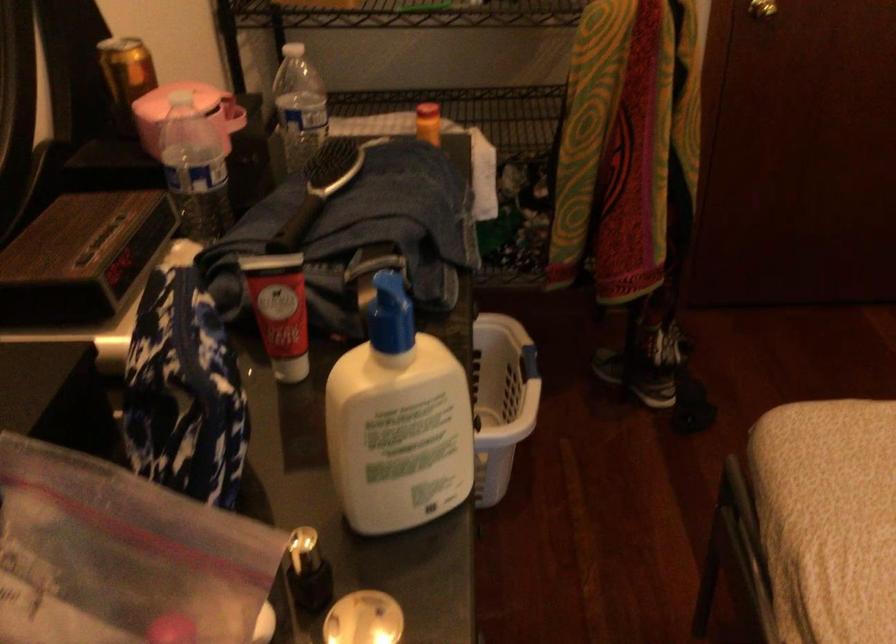
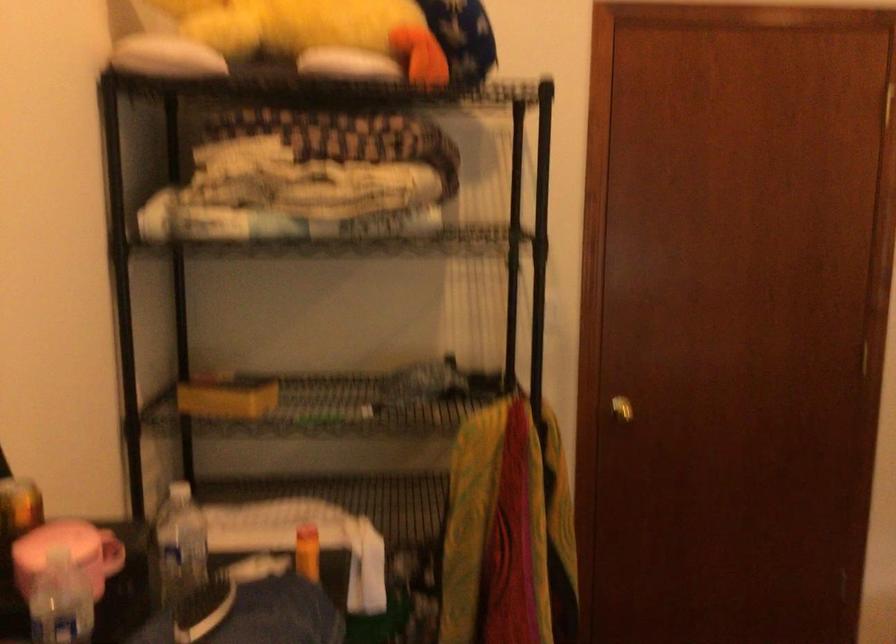
Looking at this image, the images are taken continuously from a first-person perspective. In which direction are you moving?

The movement direction of the cameraman is right, backward.